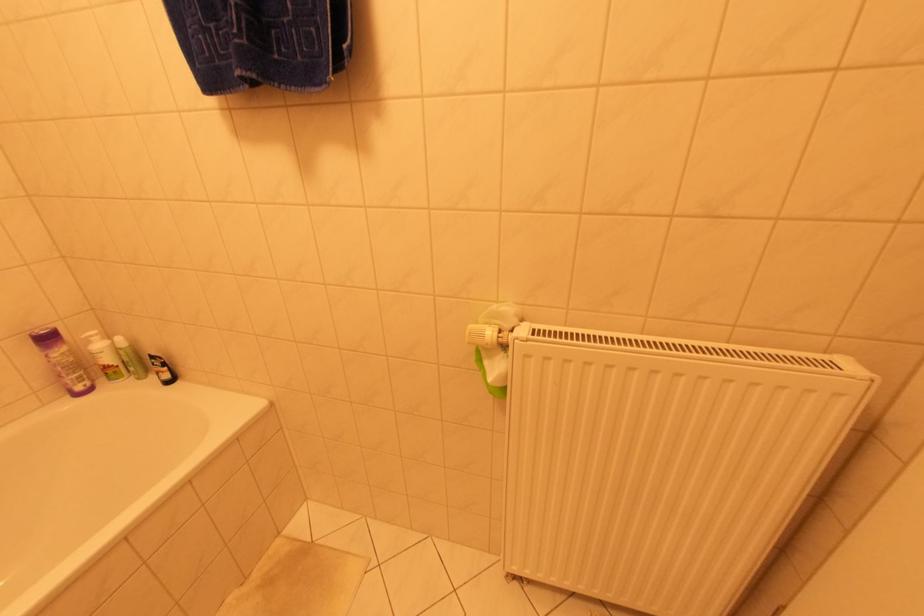
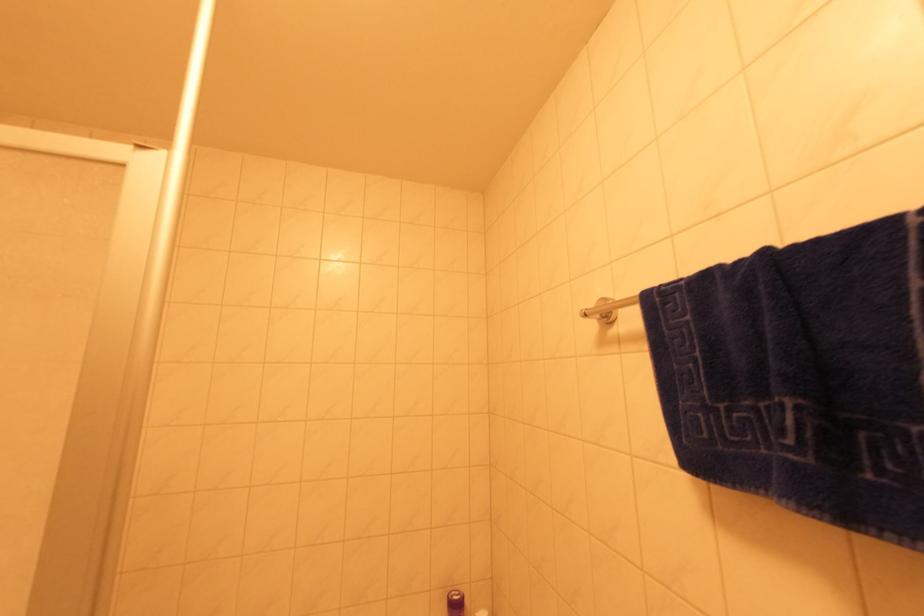
Based on the continuous images, in which direction is the camera rotating?

The camera rotated toward left-up.